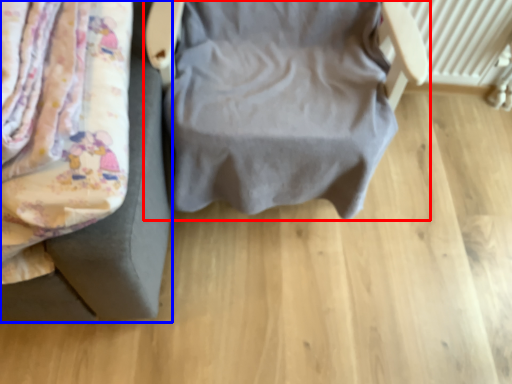
Question: Among these objects, which one is farthest to the camera, furniture (highlighted by a red box) or furniture (highlighted by a blue box)?

Choices:
 (A) furniture
 (B) furniture

Answer: (A)